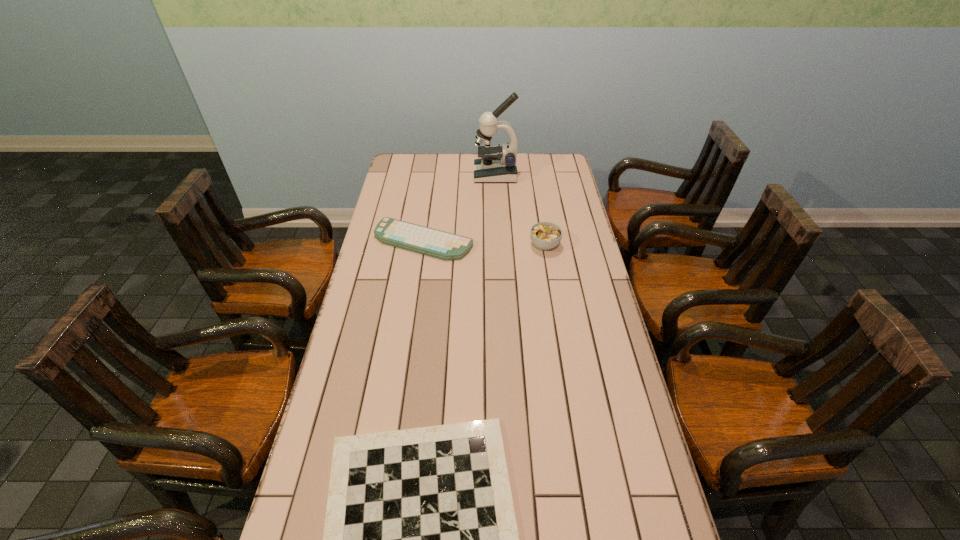
Where is `object at the right edge`? object at the right edge is located at coordinates (545, 235).

The width and height of the screenshot is (960, 540). Find the location of `vacant space at the far edge`. vacant space at the far edge is located at coordinates (529, 171).

Where is `vacant space at the left edge of the desktop`? Image resolution: width=960 pixels, height=540 pixels. vacant space at the left edge of the desktop is located at coordinates (369, 409).

Find the location of a particular element. The width and height of the screenshot is (960, 540). free region at the right edge of the desktop is located at coordinates (570, 206).

The height and width of the screenshot is (540, 960). Find the location of `vacant position at the far left corner of the desktop`. vacant position at the far left corner of the desktop is located at coordinates (398, 154).

You are a GUI agent. You are given a task and a screenshot of the screen. Output one action in this format:
    pyautogui.click(x=<x>, y=<y>)
    Task: Click on the free spot between the soup bowl and the third tallest object
    
    Given the screenshot: What is the action you would take?
    pyautogui.click(x=484, y=242)

Find the location of `vacant point located between the computer keyboard and the tallest object`. vacant point located between the computer keyboard and the tallest object is located at coordinates (460, 207).

Identify the location of free area in between the second shortest object and the second tallest object. Image resolution: width=960 pixels, height=540 pixels. (484, 242).

Identify the location of free spot between the computer keyboard and the farthest object. (460, 207).

The height and width of the screenshot is (540, 960). In order to click on unoccupied position between the rightmost object and the farthest object in this screenshot , I will do `click(520, 210)`.